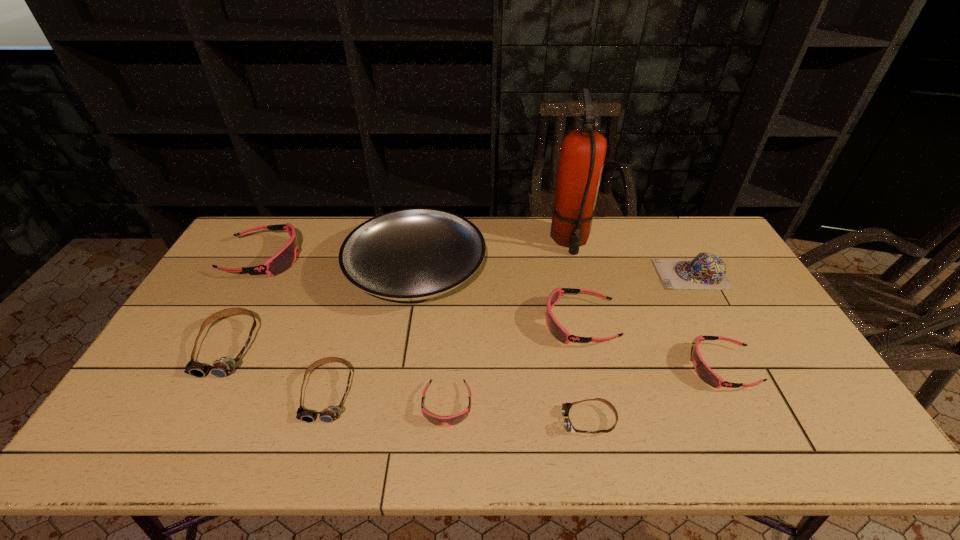
Find the location of a particular element. This screenshot has height=540, width=960. free space that satisfies the following two spatial constraints: 1. on the nozzle of the tallest object; 2. on the front-facing side of the smallest brown goggles is located at coordinates (614, 421).

Where is `vacant space that satisfies the following two spatial constraints: 1. on the front-facing side of the third pink goggles from left to right; 2. on the front-facing side of the biggest brown goggles`? Image resolution: width=960 pixels, height=540 pixels. vacant space that satisfies the following two spatial constraints: 1. on the front-facing side of the third pink goggles from left to right; 2. on the front-facing side of the biggest brown goggles is located at coordinates (586, 347).

You are a GUI agent. You are given a task and a screenshot of the screen. Output one action in this format:
    pyautogui.click(x=<x>, y=<y>)
    Task: Click on the free location that satisfies the following two spatial constraints: 1. on the nozzle of the tallest object; 2. on the front-facing side of the rightmost brown goggles
    This screenshot has height=540, width=960.
    Given the screenshot: What is the action you would take?
    [614, 421]